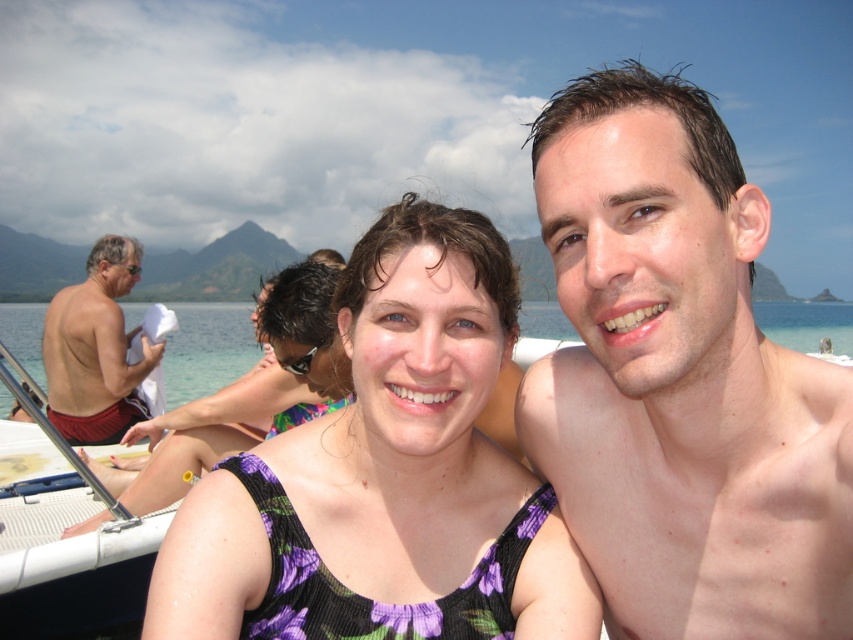
Is point (741, 353) positioned behind point (67, 339)?

No, it is not.

Which is below, pale skin at center or shiny red shorts at left?

Positioned lower is shiny red shorts at left.

Measure the distance between pale skin at center and camera.

They are 5.74 feet apart.

The height and width of the screenshot is (640, 853). What are the coordinates of `pale skin at center` in the screenshot? It's located at (680, 380).

Can you confirm if clear blue water at center is wider than shiny red shorts at left?

Yes, clear blue water at center is wider than shiny red shorts at left.

Who is more distant from viewer, (21, 349) or (64, 378)?

Positioned behind is point (21, 349).

I want to click on clear blue water at center, so [207, 348].

Is purple floral tank top at center positioned at the back of purple floral swimsuit at center?

→ No, it is not.

Describe the element at coordinates (387, 476) in the screenshot. I see `purple floral tank top at center` at that location.

You are a GUI agent. You are given a task and a screenshot of the screen. Output one action in this format:
    pyautogui.click(x=<x>, y=<y>)
    Task: Click on the purple floral tank top at center
    This screenshot has width=853, height=640.
    Given the screenshot: What is the action you would take?
    pyautogui.click(x=387, y=476)